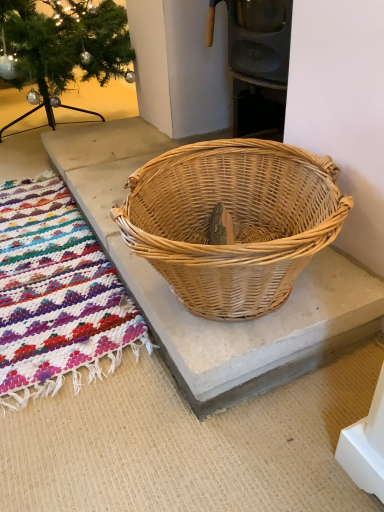
Locate an element on the screen. The height and width of the screenshot is (512, 384). natural wicker basket at center is located at coordinates (x=233, y=221).

Describe the element at coordinates (233, 221) in the screenshot. I see `natural wicker basket at center` at that location.

What is the approximate height of natural wicker basket at center?

natural wicker basket at center is 21.17 centimeters tall.

Describe the element at coordinates (56, 295) in the screenshot. I see `multicolored woven mat at lower left` at that location.

This screenshot has height=512, width=384. Identify the location of multicolored woven mat at lower left. (56, 295).

Find the location of a particular element. The height and width of the screenshot is (512, 384). natural wicker basket at center is located at coordinates (233, 221).

Considering the positions of objects multicolored woven mat at lower left and natural wicker basket at center in the image provided, who is more to the left, multicolored woven mat at lower left or natural wicker basket at center?

From the viewer's perspective, multicolored woven mat at lower left appears more on the left side.

Is multicolored woven mat at lower left closer to the viewer compared to natural wicker basket at center?

No, the depth of multicolored woven mat at lower left is greater than that of natural wicker basket at center.

Which is closer, (9, 292) or (231, 315)?

Clearly, point (9, 292) is more distant from the camera than point (231, 315).

From the image's perspective, which object appears higher, multicolored woven mat at lower left or natural wicker basket at center?

natural wicker basket at center, from the image's perspective.

From a real-world perspective, is multicolored woven mat at lower left physically above natural wicker basket at center?

No, from a real-world perspective, multicolored woven mat at lower left is not on top of natural wicker basket at center.

Does multicolored woven mat at lower left have a greater width compared to natural wicker basket at center?

No, multicolored woven mat at lower left is not wider than natural wicker basket at center.

From their relative heights in the image, would you say multicolored woven mat at lower left is taller or shorter than natural wicker basket at center?

Clearly, multicolored woven mat at lower left is shorter compared to natural wicker basket at center.

Is multicolored woven mat at lower left smaller than natural wicker basket at center?

Yes.

Is natural wicker basket at center completely or partially inside multicolored woven mat at lower left?

That's incorrect, natural wicker basket at center is not inside multicolored woven mat at lower left.

Is multicolored woven mat at lower left positioned far away from natural wicker basket at center?

No, multicolored woven mat at lower left is not far from natural wicker basket at center.

Is multicolored woven mat at lower left facing away from natural wicker basket at center?

No.

How much distance is there between multicolored woven mat at lower left and natural wicker basket at center?

A distance of 12.80 inches exists between multicolored woven mat at lower left and natural wicker basket at center.

Identify the location of picnic basket above the multicolored woven mat at lower left (from a real-world perspective). The width and height of the screenshot is (384, 512). tap(233, 221).

Looking at this image, considering the positions of objects natural wicker basket at center and multicolored woven mat at lower left in the image provided, who is more to the left, natural wicker basket at center or multicolored woven mat at lower left?

multicolored woven mat at lower left.

Is natural wicker basket at center behind multicolored woven mat at lower left?

No.

Does point (295, 264) come farther from viewer compared to point (16, 221)?

No, it is in front of (16, 221).

From the image's perspective, which object appears higher, natural wicker basket at center or multicolored woven mat at lower left?

natural wicker basket at center.

From a real-world perspective, is natural wicker basket at center positioned above or below multicolored woven mat at lower left?

From a real-world perspective, natural wicker basket at center is physically above multicolored woven mat at lower left.

Which of these two, natural wicker basket at center or multicolored woven mat at lower left, is wider?

Wider between the two is natural wicker basket at center.

Which of these two, natural wicker basket at center or multicolored woven mat at lower left, stands shorter?

Standing shorter between the two is multicolored woven mat at lower left.

In the scene shown: Based on their sizes in the image, would you say natural wicker basket at center is bigger or smaller than multicolored woven mat at lower left?

natural wicker basket at center is bigger than multicolored woven mat at lower left.

Which is correct: natural wicker basket at center is inside multicolored woven mat at lower left, or outside of it?

natural wicker basket at center cannot be found inside multicolored woven mat at lower left.

Are natural wicker basket at center and multicolored woven mat at lower left far apart?

No, natural wicker basket at center is not far from multicolored woven mat at lower left.

From the picture: Is natural wicker basket at center positioned with its back to multicolored woven mat at lower left?

natural wicker basket at center is not turned away from multicolored woven mat at lower left.

Can you tell me how much natural wicker basket at center and multicolored woven mat at lower left differ in facing direction?

2.09 degrees separate the facing orientations of natural wicker basket at center and multicolored woven mat at lower left.

In order to click on picnic basket in front of the multicolored woven mat at lower left in this screenshot , I will do coord(233,221).

The height and width of the screenshot is (512, 384). Find the location of `picnic basket on the right of the multicolored woven mat at lower left`. picnic basket on the right of the multicolored woven mat at lower left is located at coordinates (233, 221).

Locate an element on the screen. The height and width of the screenshot is (512, 384). mat that is below the natural wicker basket at center (from the image's perspective) is located at coordinates (56, 295).